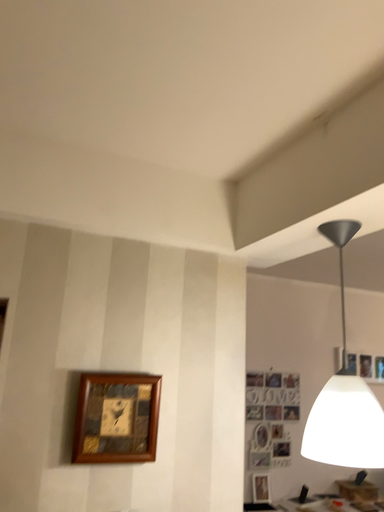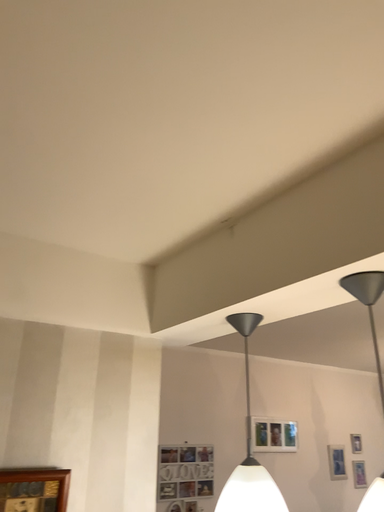
Question: Which way did the camera rotate in the video?

Choices:
 (A) rotated downward
 (B) rotated upward

Answer: (B)